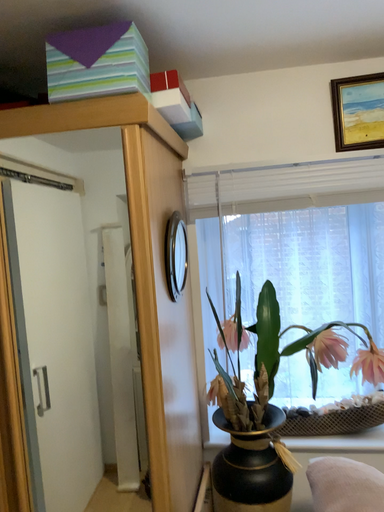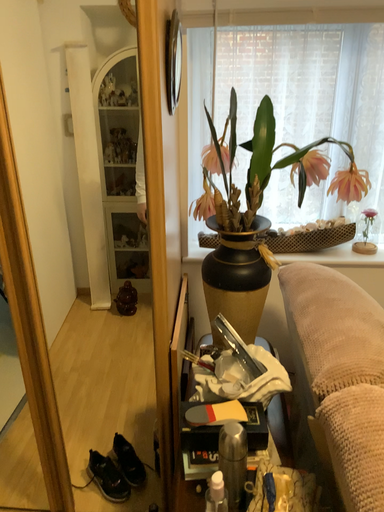
Question: Which way did the camera rotate in the video?

Choices:
 (A) rotated downward
 (B) rotated upward

Answer: (A)